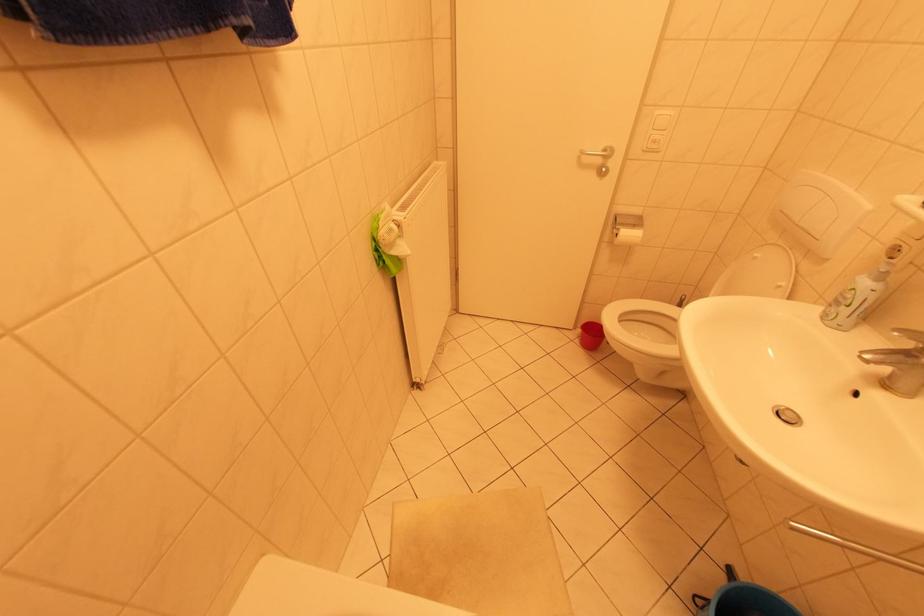
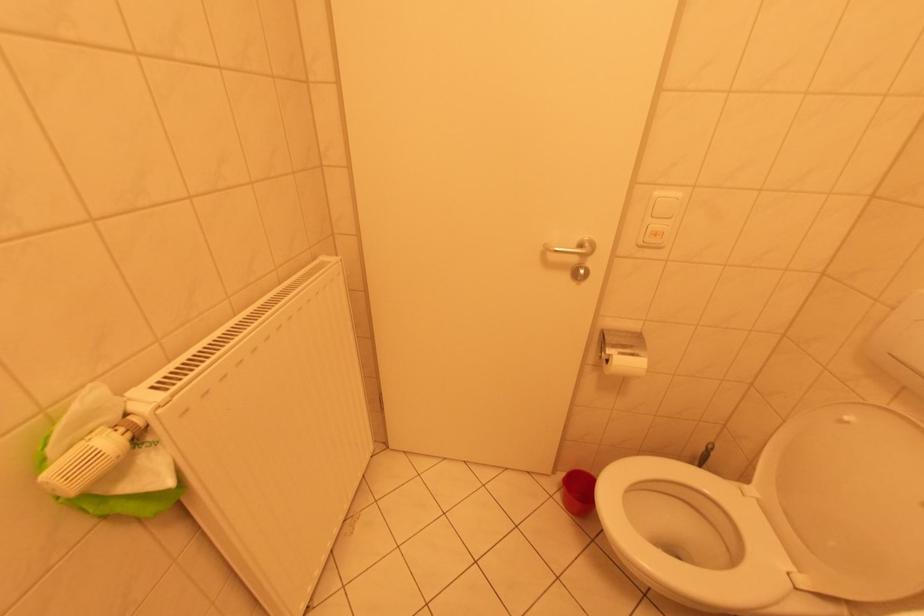
Question: The first image is from the beginning of the video and the second image is from the end. How did the camera likely rotate when shooting the video?

Choices:
 (A) Left
 (B) Right
 (C) Up
 (D) Down

Answer: (C)